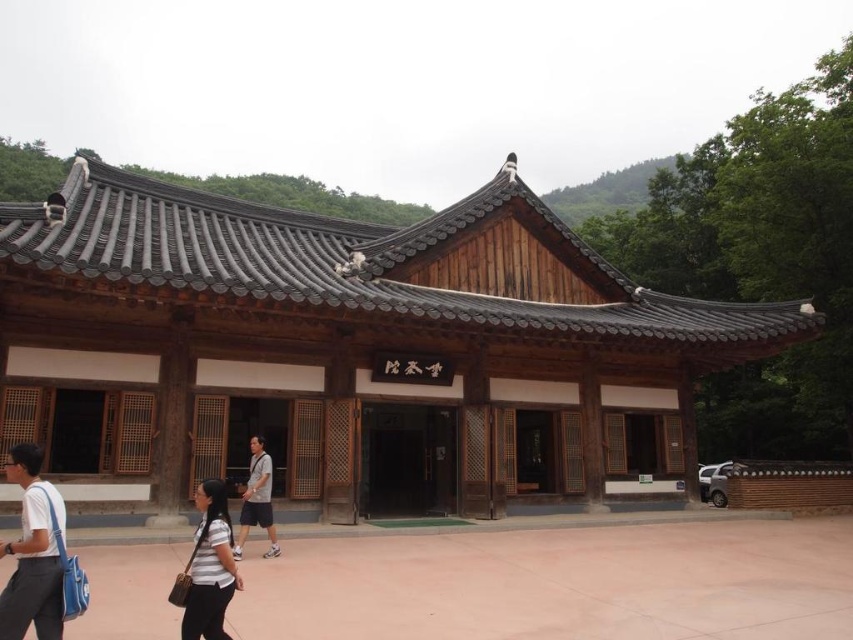
You are standing in front of the traditional Korean building and want to move from point A to point B. Point A is at coordinate point (283, 221) and point B is at coordinate point (242, 513). Which point is closer to you when you are facing the building?

Point A at coordinate point (283, 221) is closer to you than point B at coordinate point (242, 513) because it is further to the viewer according to the description.

You are standing in front of the brown wooden temple at center. You want to take a photo of the temple from a distance that is exactly 30 feet away. Is the current distance sufficient?

The distance between you and the brown wooden temple at center is 27.26 feet, which is less than 30 feet. Therefore, you need to move back approximately 2.74 feet to achieve the desired distance.